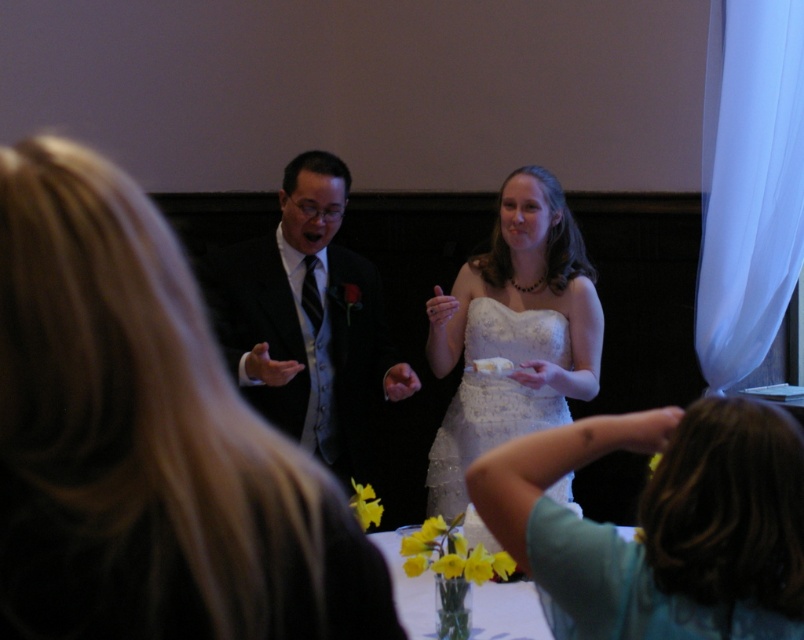
Question: Which is farther from the white lace dress at center?

Choices:
 (A) black satin suit at center
 (B) light brown hair at lower right

Answer: (B)

Question: Is light brown hair at lower right positioned at the back of white lace dress at center?

Choices:
 (A) no
 (B) yes

Answer: (A)

Question: Which object is the closest to the black satin suit at center?

Choices:
 (A) white lace dress at center
 (B) light brown hair at lower right
 (C) matte white dress at center

Answer: (A)

Question: From the image, what is the correct spatial relationship of matte white dress at center in relation to black satin suit at center?

Choices:
 (A) above
 (B) below

Answer: (B)

Question: Observing the image, what is the correct spatial positioning of black satin suit at center in reference to white lace dress at center?

Choices:
 (A) left
 (B) right

Answer: (A)

Question: Estimate the real-world distances between objects in this image. Which object is farther from the light brown hair at lower right?

Choices:
 (A) white lace dress at center
 (B) matte white dress at center

Answer: (A)